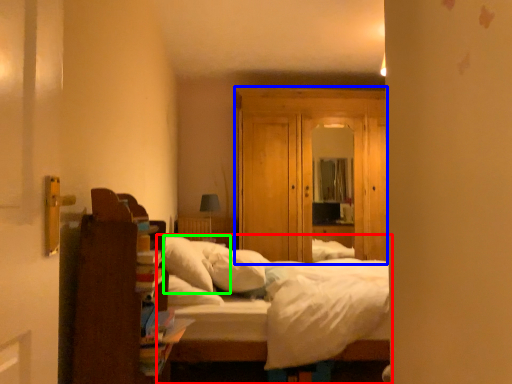
Question: Estimate the real-world distances between objects in this image. Which object is closer to bed (highlighted by a red box), dresser (highlighted by a blue box) or pillow (highlighted by a green box)?

Choices:
 (A) dresser
 (B) pillow

Answer: (B)